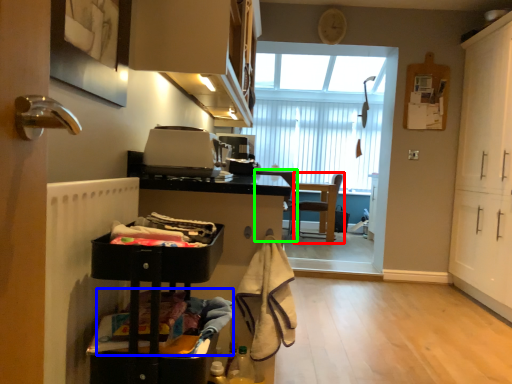
Question: Which object is the closest to the chair (highlighted by a red box)? Choose among these: laundry (highlighted by a blue box) or chair (highlighted by a green box).

Choices:
 (A) laundry
 (B) chair

Answer: (B)